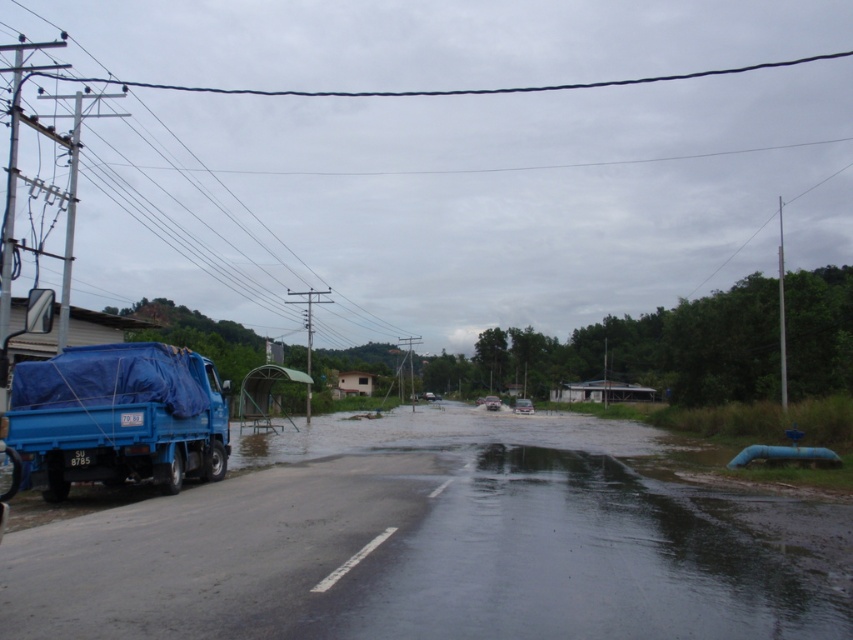
Question: Is black wire at upper center below blue tarpaulin flood at left?

Choices:
 (A) yes
 (B) no

Answer: (B)

Question: Is black wire at upper center bigger than blue tarpaulin flood at left?

Choices:
 (A) no
 (B) yes

Answer: (B)

Question: Which point is closer to the camera?

Choices:
 (A) (67, 529)
 (B) (273, 12)
 (C) (140, 349)

Answer: (A)

Question: Is black wire at upper center to the right of blue tarpaulin truck at left from the viewer's perspective?

Choices:
 (A) no
 (B) yes

Answer: (B)

Question: Which point is closer to the camera?

Choices:
 (A) (419, 513)
 (B) (135, 465)

Answer: (A)

Question: Based on their relative distances, which object is nearer to the black wire at upper center?

Choices:
 (A) blue tarpaulin flood at left
 (B) blue tarpaulin truck at left

Answer: (A)